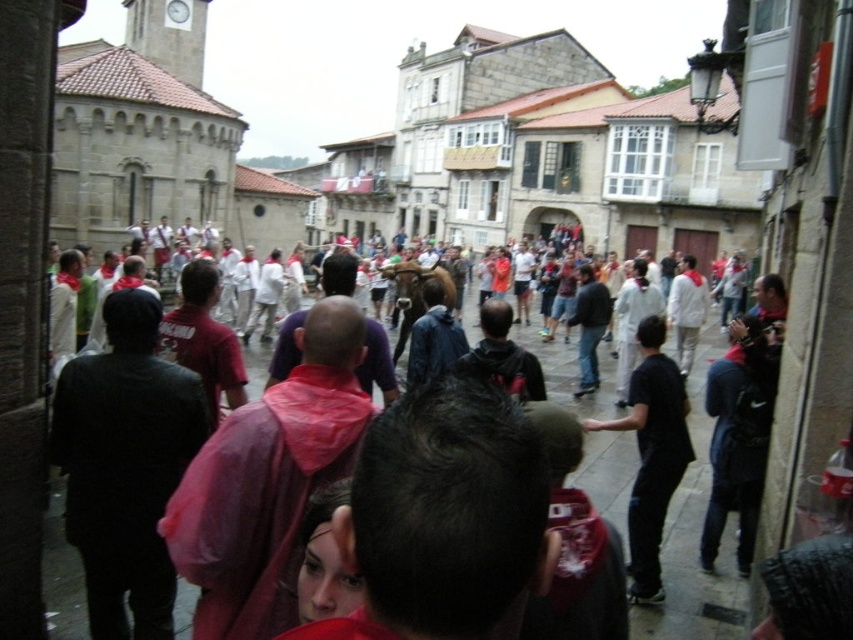
You are a photographer trying to capture a clear shot of both the pink raincoat at center and the black matte shirt at center. Given their positions and sizes, which object should you focus on first to ensure both are in frame without moving the camera?

The pink raincoat at center is wider than the black matte shirt at center, so you should focus on the pink raincoat at center first to ensure it fits within the frame. Once centered on the pink raincoat at center, the narrower black matte shirt at center will likely also be included in the shot.

You are standing at the center of the street and want to locate the pink raincoat at center. According to the coordinates provided, in which direction should you look to find it?

The pink raincoat at center is located at coordinates point (x=695, y=536), so you should look to the lower right direction from the center to find it.

In the scene shown: You are a photographer trying to capture a candid shot of both the pink raincoat at center and the black matte shirt at center in the lively street scene. Given that your camera has a maximum focus range of 25 feet, can you fit both subjects into the frame without moving closer?

The distance between the pink raincoat at center and the black matte shirt at center is 25.10 feet, which exceeds the camera lens focus range of 25 feet. Therefore, you cannot fit both subjects into the frame without moving closer.